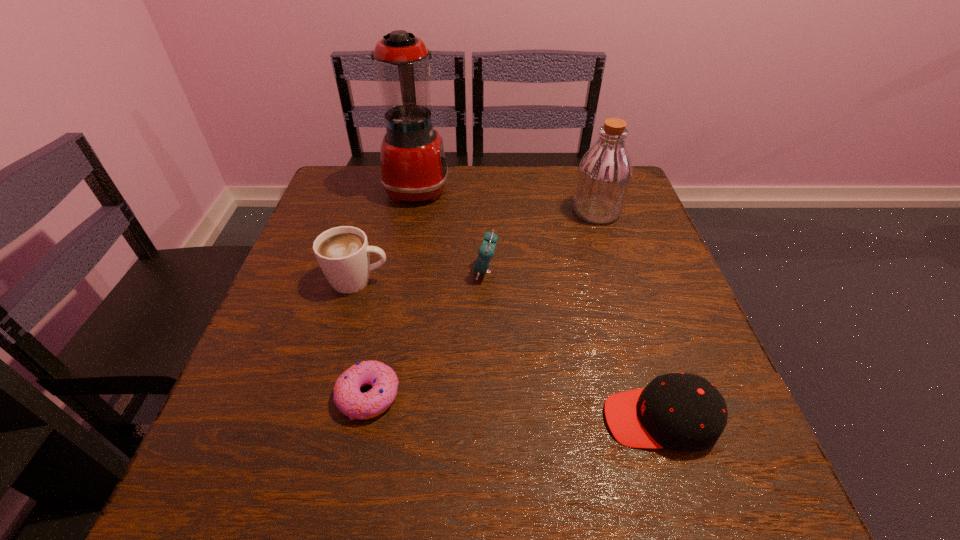
Identify the location of the tallest object. Image resolution: width=960 pixels, height=540 pixels. (413, 166).

The width and height of the screenshot is (960, 540). I want to click on bottle, so click(x=604, y=175).

The height and width of the screenshot is (540, 960). I want to click on cappuccino, so click(x=342, y=252).

This screenshot has height=540, width=960. In order to click on alarm clock in this screenshot , I will do `click(486, 251)`.

Locate an element on the screen. Image resolution: width=960 pixels, height=540 pixels. cap is located at coordinates click(683, 412).

Locate an element on the screen. This screenshot has height=540, width=960. the shortest object is located at coordinates (348, 398).

Locate an element on the screen. Image resolution: width=960 pixels, height=540 pixels. vacant area situated on the controls of the tallest object is located at coordinates (505, 188).

Locate an element on the screen. Image resolution: width=960 pixels, height=540 pixels. vacant space located on the back of the fifth shortest object is located at coordinates (587, 181).

The height and width of the screenshot is (540, 960). What are the coordinates of `free space located 0.100m with the handle on the side of the cappuccino` in the screenshot? It's located at (438, 280).

At what (x,y) coordinates should I click in order to perform the action: click on free spot located on the face of the third object from right to left. Please return your answer as a coordinate pair (x, y). This screenshot has height=540, width=960. Looking at the image, I should click on [x=413, y=272].